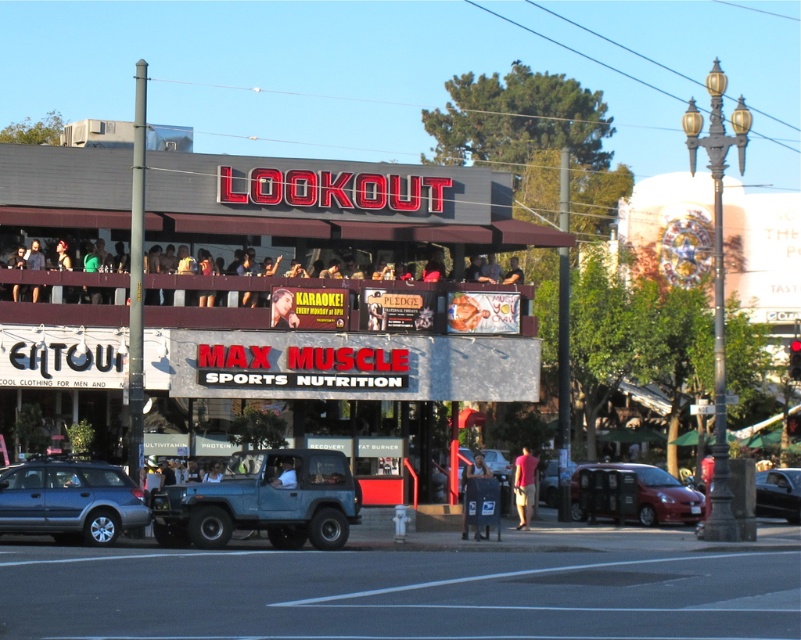
Question: Is metallic silver car at center wider than light blue fabric shirt at center?

Choices:
 (A) no
 (B) yes

Answer: (B)

Question: Which object is positioned closest to the metallic silver car at center?

Choices:
 (A) dark gray signboard at upper center
 (B) matte black shirt at upper center
 (C) smooth skin face at upper center

Answer: (A)

Question: Does dark blue jeans at center appear under light blue fabric shirt at center?

Choices:
 (A) no
 (B) yes

Answer: (B)

Question: Which point is closer to the camera?

Choices:
 (A) dark gray signboard at upper center
 (B) metallic red car at lower right

Answer: (A)

Question: Which is nearer to the black glossy car at lower right?

Choices:
 (A) teal matte jeep at center
 (B) metallic silver car at center
 (C) dark gray signboard at upper center

Answer: (B)

Question: Can you confirm if dark gray signboard at upper center is smaller than dark blue jeans at center?

Choices:
 (A) no
 (B) yes

Answer: (A)